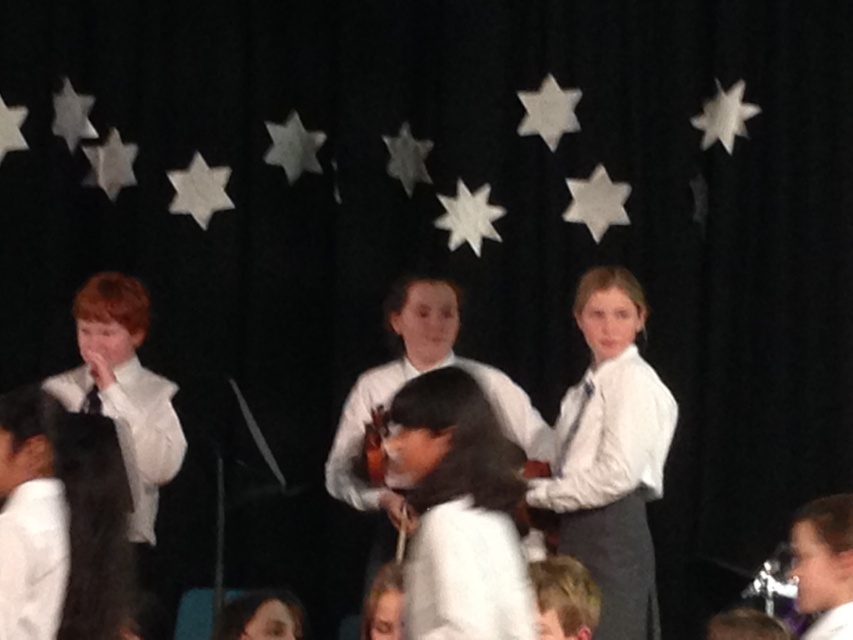
Question: Which point is closer to the camera taking this photo?

Choices:
 (A) (799, 586)
 (B) (39, 422)
 (C) (637, 401)

Answer: (B)

Question: Which object appears farthest from the camera in this image?

Choices:
 (A) white shirt at lower left
 (B) white satin shirt at center
 (C) smooth brown hair at center
 (D) white fabric shirt at center

Answer: (B)

Question: Does white fabric shirt at center appear on the left side of smooth brown hair at center?

Choices:
 (A) yes
 (B) no

Answer: (A)

Question: Among these objects, which one is nearest to the camera?

Choices:
 (A) white fabric shirt at center
 (B) white satin shirt at center
 (C) smooth brown hair at center
 (D) white shirt at lower left

Answer: (A)

Question: Where is white fabric shirt at center located in relation to white shirt at lower left in the image?

Choices:
 (A) right
 (B) left

Answer: (A)

Question: Does white fabric shirt at center appear on the left side of smooth brown hair at center?

Choices:
 (A) yes
 (B) no

Answer: (A)